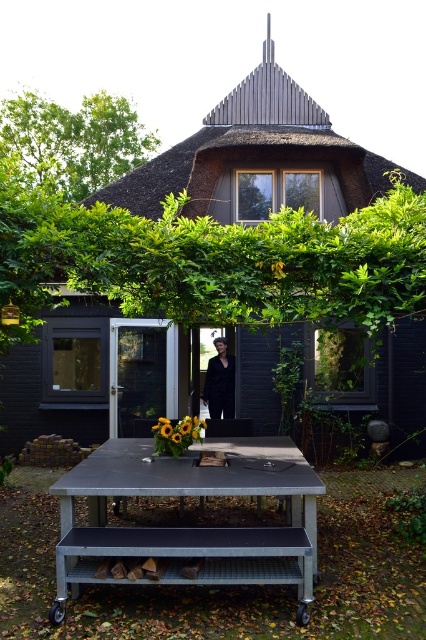
Question: Which point appears farthest from the camera in this image?

Choices:
 (A) (120, 452)
 (B) (268, 92)

Answer: (B)

Question: Which of these objects is positioned farthest from the black fabric at center?

Choices:
 (A) black wood hut at center
 (B) metallic gray table at center

Answer: (B)

Question: Which of the following is the closest to the observer?

Choices:
 (A) (230, 380)
 (B) (172, 460)
 (C) (388, 180)

Answer: (B)

Question: Does black wood hut at center have a lesser width compared to black fabric at center?

Choices:
 (A) no
 (B) yes

Answer: (A)

Question: Is metallic gray table at center wider than black fabric at center?

Choices:
 (A) no
 (B) yes

Answer: (B)

Question: Is black wood hut at center bigger than black fabric at center?

Choices:
 (A) yes
 (B) no

Answer: (A)